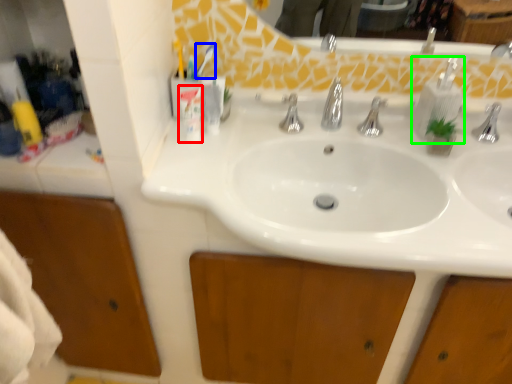
Question: Considering the real-world distances, which object is closest to toiletry (highlighted by a red box)? toothbrush (highlighted by a blue box) or soap dispenser (highlighted by a green box).

Choices:
 (A) toothbrush
 (B) soap dispenser

Answer: (A)